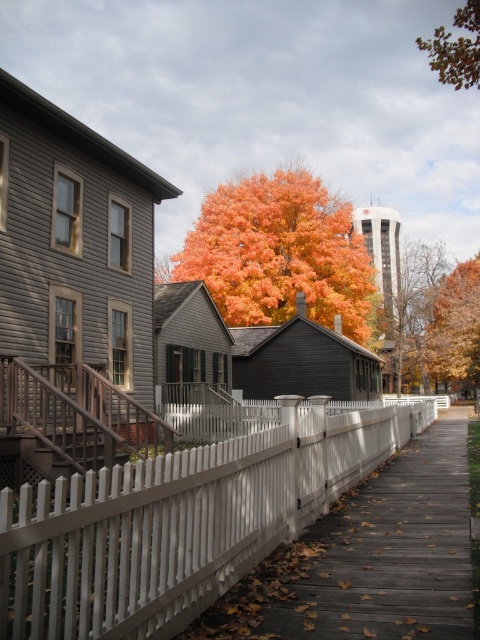
You are standing on the walkway and looking up at the two trees at the upper right corner. Which tree appears closer to you between the orange matte tree at upper right and the brown leafy tree at upper right?

The orange matte tree at upper right appears closer to you because it is further to the viewer than the brown leafy tree at upper right.

You are standing on the wooden walkway and want to compare the sizes of the orange leafy tree at center and the brown leafy tree at upper right. Which tree has a wider spread?

The brown leafy tree at upper right has a wider spread than the orange leafy tree at center.

You are standing on the wooden walkway in the autumn scene and want to move from the point at coordinates point [24,547] to the point at coordinates point [250,291]. Based on the scene description, which direction should you walk to reach your destination?

You should walk backward or towards the direction away from the houses because point [24,547] is in front of point [250,291], meaning the destination is behind your starting position relative to the walkway.